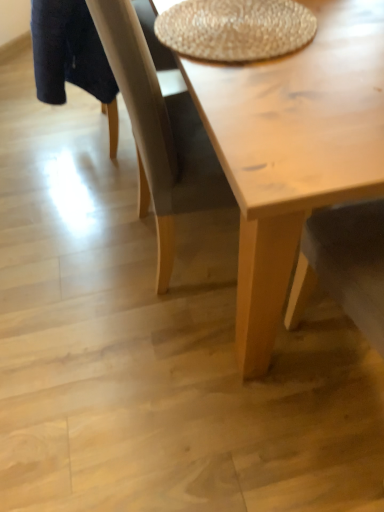
Question: In the image, is braided straw placemat at upper center positioned in front of or behind light wood table at center?

Choices:
 (A) front
 (B) behind

Answer: (B)

Question: In terms of size, does braided straw placemat at upper center appear bigger or smaller than light wood table at center?

Choices:
 (A) small
 (B) big

Answer: (A)

Question: Considering the relative positions of braided straw placemat at upper center and light wood table at center in the image provided, is braided straw placemat at upper center to the left or to the right of light wood table at center?

Choices:
 (A) left
 (B) right

Answer: (B)

Question: Based on their sizes in the image, would you say light wood table at center is bigger or smaller than braided straw placemat at upper center?

Choices:
 (A) big
 (B) small

Answer: (A)

Question: From a real-world perspective, is light wood table at center physically located above or below braided straw placemat at upper center?

Choices:
 (A) above
 (B) below

Answer: (B)

Question: Is light wood table at center taller or shorter than braided straw placemat at upper center?

Choices:
 (A) short
 (B) tall

Answer: (B)

Question: Based on their positions, is light wood table at center located to the left or right of braided straw placemat at upper center?

Choices:
 (A) left
 (B) right

Answer: (A)